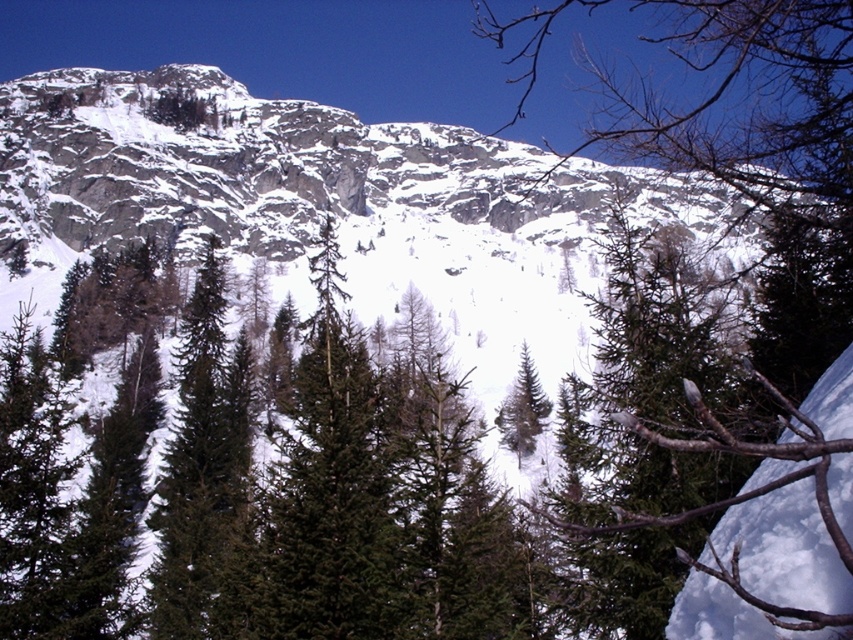
Is rocky gray mountain at upper center bigger than green matte tree at center?

No.

Between rocky gray mountain at upper center and green matte tree at center, which one has less height?

Standing shorter between the two is rocky gray mountain at upper center.

Does point (561, 166) lie in front of point (715, 19)?

No, (561, 166) is further to viewer.

Where is `rocky gray mountain at upper center`? rocky gray mountain at upper center is located at coordinates (265, 164).